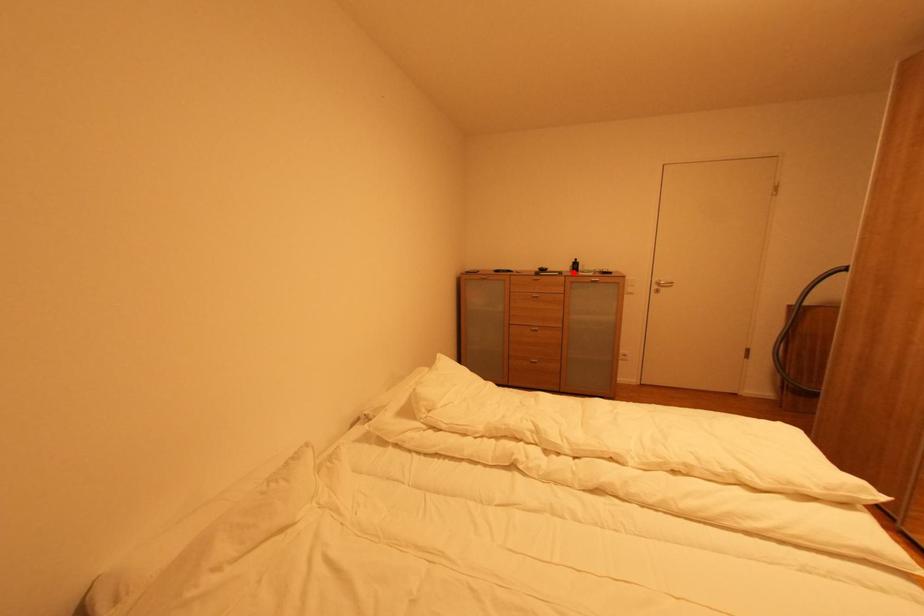
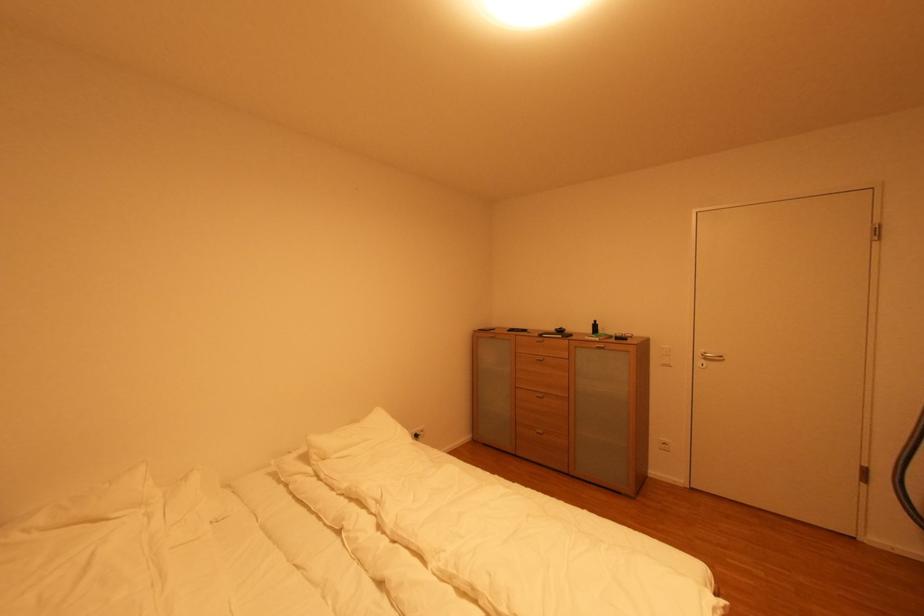
The point at the highlighted location is marked in the first image. Where is the corresponding point in the second image?

(594, 334)